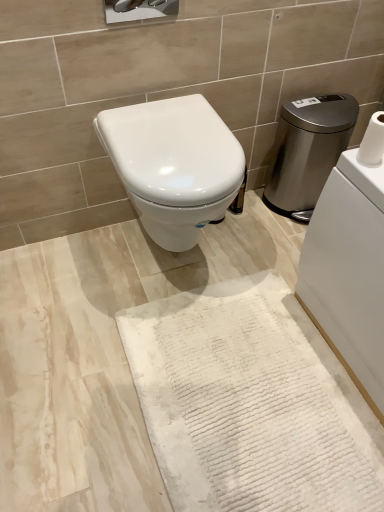
Locate an element on the screen. Image resolution: width=384 pixels, height=512 pixels. empty space that is ontop of white glossy toilet at center (from a real-world perspective) is located at coordinates [163, 130].